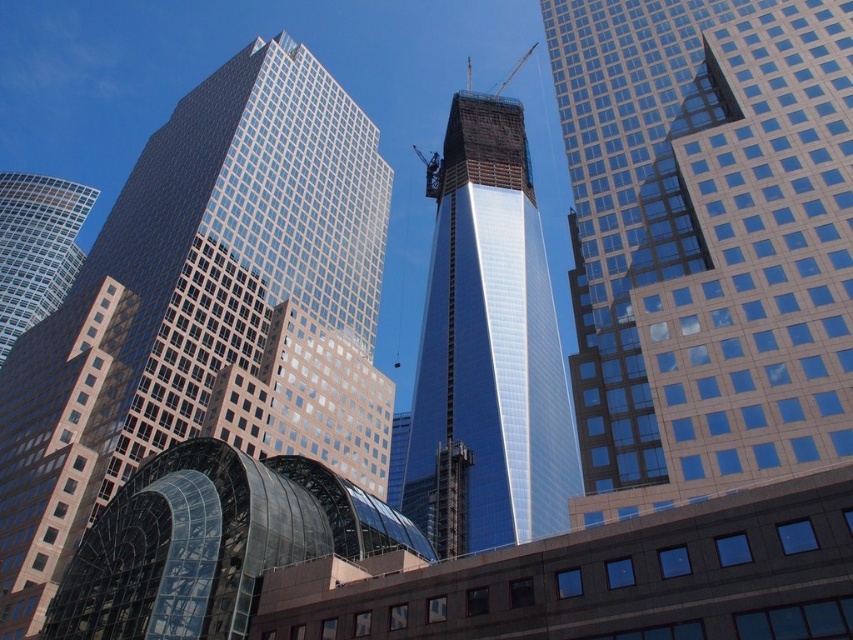
You are standing in front of the cluster of modern skyscrapers and notice two points marked on the central building under construction. The first point is at coordinate point [669,307] and the second is at point [210,227]. Which point is nearer to your current position?

Point [669,307] is closer to the camera than point [210,227], so the first point is nearer to your current position.

You are an architect planning to install a billboard on the side of the glassy steel skyscraper at center and the glassy reflective skyscraper at center. Since the billboard requires a minimum width of 10 meters to be visible from afar, which building do you think will definitely fit the billboard?

The glassy reflective skyscraper at center has a greater width than the glassy steel skyscraper at center. Since the billboard requires a minimum width of 10 meters, the glassy reflective skyscraper at center is more likely to have sufficient width to accommodate the billboard, while the glassy steel skyscraper at center might be too narrow.